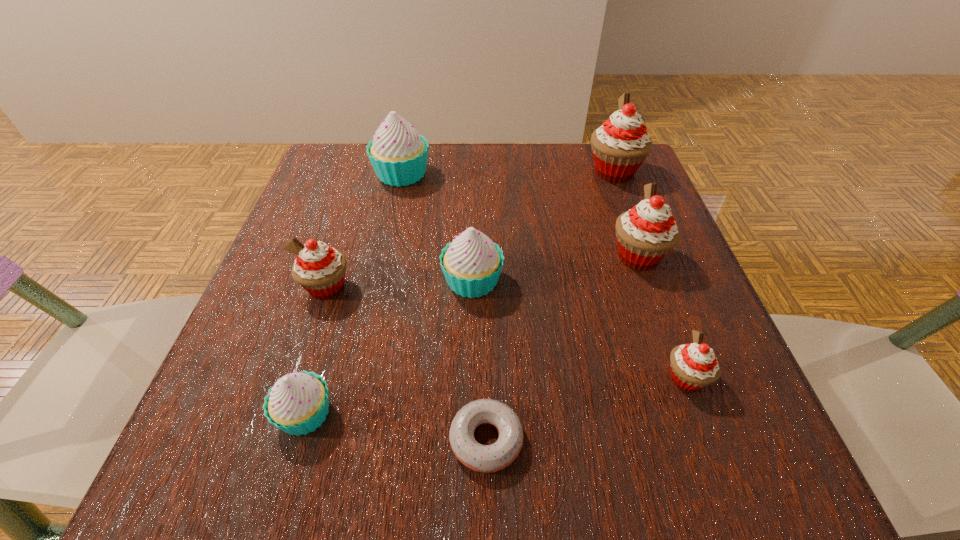
At what (x,y) coordinates should I click in order to perform the action: click on object situated at the far left corner. Please return your answer as a coordinate pair (x, y). This screenshot has height=540, width=960. Looking at the image, I should click on (398, 154).

Find the location of `object that is at the near left corner`. object that is at the near left corner is located at coordinates (298, 403).

Where is `object located at the far right corner`? The image size is (960, 540). object located at the far right corner is located at coordinates (619, 147).

You are a GUI agent. You are given a task and a screenshot of the screen. Output one action in this format:
    pyautogui.click(x=<x>, y=<y>)
    Task: Click on the vacant position at the far edge of the desktop
    
    Given the screenshot: What is the action you would take?
    pyautogui.click(x=387, y=191)

Find the location of a particular element. The image size is (960, 540). blank area at the near edge is located at coordinates (612, 481).

This screenshot has width=960, height=540. What are the coordinates of `free region at the left edge` in the screenshot? It's located at (259, 358).

What are the coordinates of `vacant region at the right edge of the desktop` in the screenshot? It's located at (715, 405).

What are the coordinates of `vacant space at the far right corner of the desktop` in the screenshot? It's located at (587, 200).

In the image, there is a desktop. At what (x,y) coordinates should I click in order to perform the action: click on vacant space at the near right corner. Please return your answer as a coordinate pair (x, y). This screenshot has height=540, width=960. Looking at the image, I should click on (681, 429).

Find the location of a particular element. vacant point located between the shortest object and the nearest white cupcake is located at coordinates (396, 427).